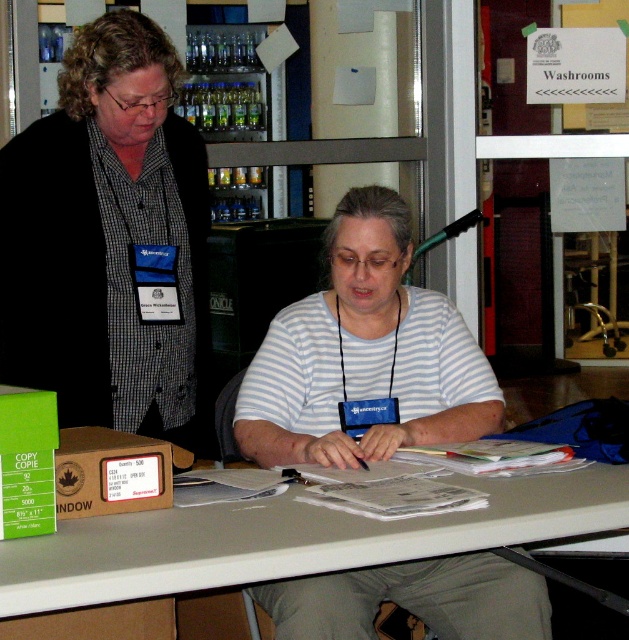
Based on the scene description, what is located at the coordinates point (364,355)?

The white striped shirt at center is located at point (364,355).

You are a photographer setting up a shoot in this scene. You want to capture both the checkered fabric shirt at left and the white striped shirt at center in a single shot without moving either subject. Which shirt should you focus on first to ensure both are in clear focus?

You should focus on the checkered fabric shirt at left first because it is closer to the camera. Since it is closer, focusing on it will ensure the white striped shirt at center, which is farther away, remains in focus as well.